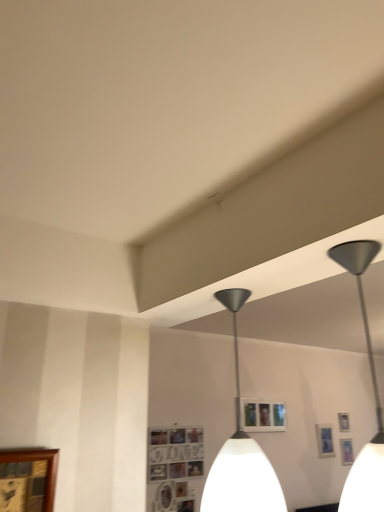
Question: From a real-world perspective, is wooden photo frame at lower center, which ranks as the 3th picture frame in right-to-left order, physically above metallic silver picture frame at upper right, the fourth picture frame from the front?

Choices:
 (A) yes
 (B) no

Answer: (B)

Question: Would you say wooden photo frame at lower center, which ranks as the 3th picture frame in right-to-left order, is outside metallic silver picture frame at upper right, the fourth picture frame from the front?

Choices:
 (A) no
 (B) yes

Answer: (B)

Question: Does wooden photo frame at lower center, the third picture frame from the bottom, have a smaller size compared to metallic silver picture frame at upper right, the 3th picture frame positioned from the top?

Choices:
 (A) yes
 (B) no

Answer: (B)

Question: Considering the relative sizes of wooden photo frame at lower center, the second picture frame in the front-to-back sequence, and metallic silver picture frame at upper right, arranged as the second picture frame when ordered from the bottom, in the image provided, is wooden photo frame at lower center, the second picture frame in the front-to-back sequence, wider than metallic silver picture frame at upper right, arranged as the second picture frame when ordered from the bottom,?

Choices:
 (A) yes
 (B) no

Answer: (B)

Question: Is wooden photo frame at lower center, which is the 3th picture frame in back-to-front order, placed right next to metallic silver picture frame at upper right, which is the third picture frame from left to right?

Choices:
 (A) yes
 (B) no

Answer: (B)

Question: Could you tell me if wooden photo frame at lower center, which is counted as the second picture frame, starting from the top, is turned towards metallic silver picture frame at upper right, arranged as the 2th picture frame when viewed from the right?

Choices:
 (A) no
 (B) yes

Answer: (A)

Question: Can you confirm if metallic silver picture frame at upper right, which is the third picture frame from left to right, is positioned to the right of metallic silver picture frame at upper right, arranged as the 4th picture frame when viewed from the top?

Choices:
 (A) no
 (B) yes

Answer: (A)

Question: Does metallic silver picture frame at upper right, the fourth picture frame from the front, have a larger size compared to metallic silver picture frame at upper right, the fourth picture frame viewed from the left?

Choices:
 (A) yes
 (B) no

Answer: (B)

Question: From the image's perspective, is metallic silver picture frame at upper right, arranged as the second picture frame when ordered from the bottom, located beneath metallic silver picture frame at upper right, marked as the 2th picture frame in a back-to-front arrangement?

Choices:
 (A) yes
 (B) no

Answer: (B)

Question: Is metallic silver picture frame at upper right, the fourth picture frame from the front, oriented away from metallic silver picture frame at upper right, arranged as the third picture frame when viewed from the front?

Choices:
 (A) no
 (B) yes

Answer: (A)

Question: Does metallic silver picture frame at upper right, the first picture frame viewed from the back, come in front of metallic silver picture frame at upper right, arranged as the 4th picture frame when viewed from the top?

Choices:
 (A) no
 (B) yes

Answer: (A)

Question: Is metallic silver picture frame at upper right, which is the third picture frame from left to right, at the left side of metallic silver picture frame at upper right, arranged as the third picture frame when viewed from the front?

Choices:
 (A) yes
 (B) no

Answer: (A)

Question: Considering the relative sizes of wooden picture frame at lower left, marked as the 4th picture frame in a right-to-left arrangement, and metallic silver picture frame at upper right, marked as the 2th picture frame in a back-to-front arrangement, in the image provided, is wooden picture frame at lower left, marked as the 4th picture frame in a right-to-left arrangement, shorter than metallic silver picture frame at upper right, marked as the 2th picture frame in a back-to-front arrangement,?

Choices:
 (A) no
 (B) yes

Answer: (A)